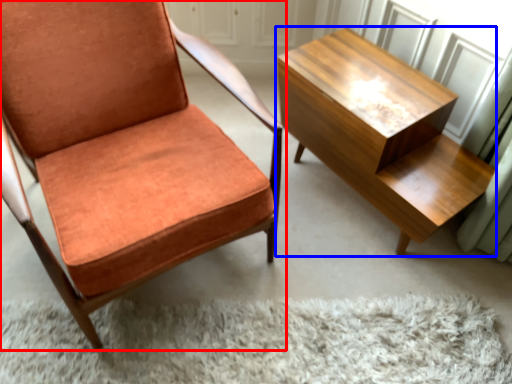
Question: Which object appears farthest to the camera in this image, chair (highlighted by a red box) or table (highlighted by a blue box)?

Choices:
 (A) chair
 (B) table

Answer: (B)